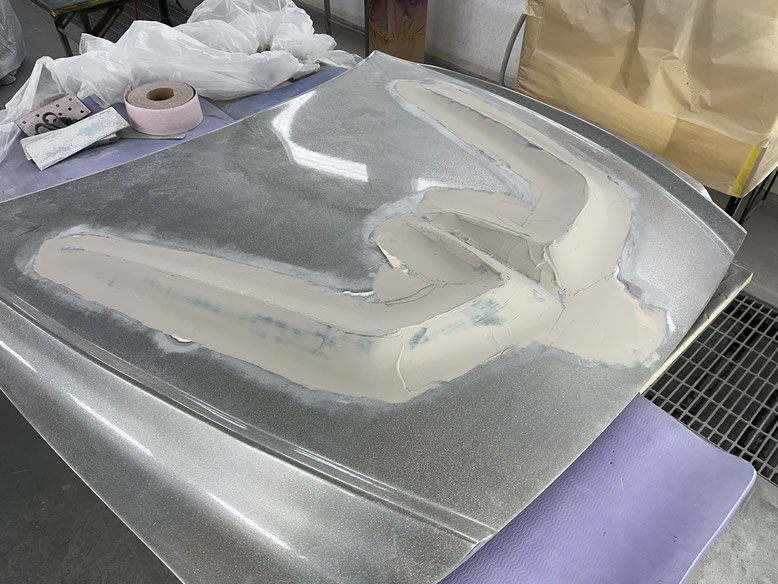
At what (x,y) coordinates should I click in order to perform the action: click on wood beam. Please return your answer as a coordinate pair (x, y). The height and width of the screenshot is (584, 778). Looking at the image, I should click on (412, 31).